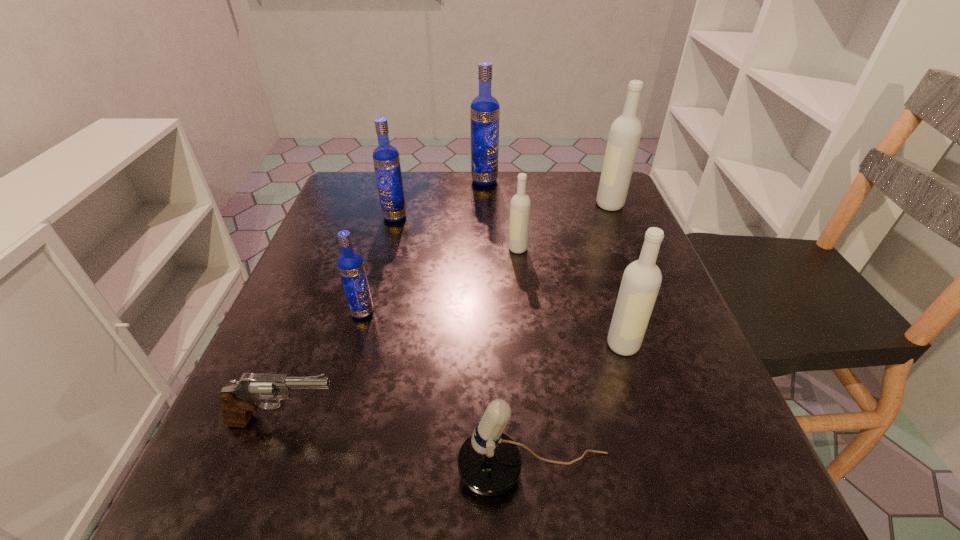
Where is `free space located on the front of the fifth nearest object`? The width and height of the screenshot is (960, 540). free space located on the front of the fifth nearest object is located at coordinates (520, 275).

Where is `vacant region located on the right of the white microphone`? vacant region located on the right of the white microphone is located at coordinates (684, 471).

Where is `free space located 0.280m at the barrel of the gray pistol`? This screenshot has width=960, height=540. free space located 0.280m at the barrel of the gray pistol is located at coordinates (531, 421).

Locate an element on the screen. object located in the near edge section of the desktop is located at coordinates (489, 462).

Identify the location of pistol that is at the left edge. Image resolution: width=960 pixels, height=540 pixels. (239, 401).

Identify the location of object present at the far left corner. Image resolution: width=960 pixels, height=540 pixels. (386, 159).

At what (x,y) coordinates should I click in order to perform the action: click on object positioned at the far right corner. Please return your answer as a coordinate pair (x, y). Looking at the image, I should click on (625, 133).

Locate an element on the screen. free location at the far edge is located at coordinates (540, 174).

Where is `vacant space at the near edge of the desktop`? This screenshot has height=540, width=960. vacant space at the near edge of the desktop is located at coordinates (444, 499).

In the image, there is a desktop. At what (x,y) coordinates should I click in order to perform the action: click on free space at the left edge. Please return your answer as a coordinate pair (x, y). The height and width of the screenshot is (540, 960). Looking at the image, I should click on (319, 271).